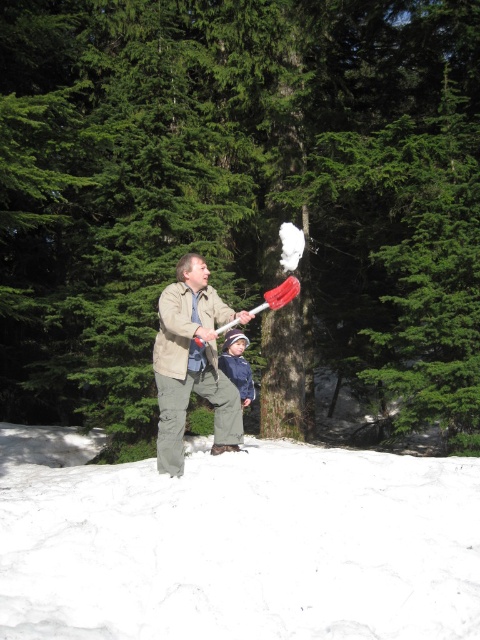
Question: Considering the real-world distances, which object is farthest from the blue denim jacket at center?

Choices:
 (A) white fluffy snow at lower center
 (B) matte khaki jacket at center

Answer: (A)

Question: Which object appears farthest from the camera in this image?

Choices:
 (A) blue denim jacket at center
 (B) green textured tree at center
 (C) white fluffy snow at lower center

Answer: (A)

Question: In this image, where is matte khaki jacket at center located relative to rubberized red shovel at center?

Choices:
 (A) below
 (B) above

Answer: (A)

Question: Is white fluffy snow at lower center thinner than rubberized red shovel at center?

Choices:
 (A) yes
 (B) no

Answer: (B)

Question: Which point is farther to the camera?

Choices:
 (A) matte khaki jacket at center
 (B) blue denim jacket at center
 (C) rubberized red shovel at center

Answer: (B)

Question: Is white fluffy snow at lower center in front of blue denim jacket at center?

Choices:
 (A) no
 (B) yes

Answer: (B)